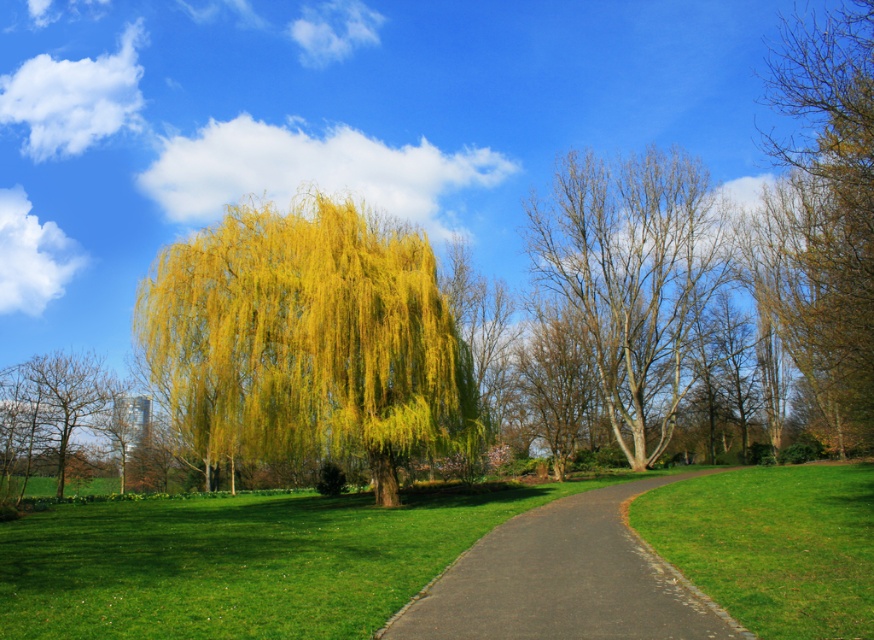
Question: Is yellow-green foliage at center to the left of black asphalt path at center from the viewer's perspective?

Choices:
 (A) yes
 (B) no

Answer: (A)

Question: Can you confirm if yellow-green foliage at center is positioned above brown/dry wood tree at right?

Choices:
 (A) yes
 (B) no

Answer: (B)

Question: Which point appears farthest from the camera in this image?

Choices:
 (A) (755, 550)
 (B) (241, 381)
 (C) (50, 401)
 (D) (771, 198)

Answer: (D)

Question: Among these points, which one is nearest to the camera?

Choices:
 (A) (608, 184)
 (B) (820, 589)
 (C) (220, 364)

Answer: (B)

Question: Based on their relative distances, which object is farther from the black asphalt path at center?

Choices:
 (A) bare wood tree at center
 (B) yellow-green foliage at center

Answer: (A)

Question: Does brown/dry wood tree at right have a larger size compared to bare wood tree at left?

Choices:
 (A) yes
 (B) no

Answer: (A)